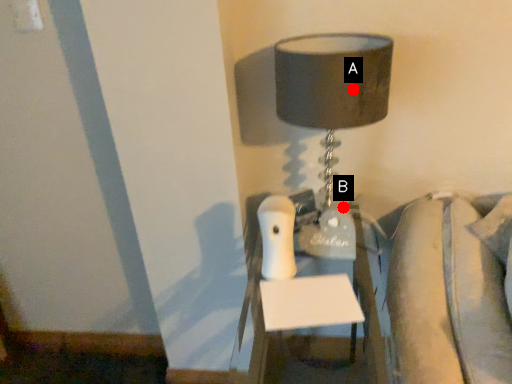
Question: Two points are circled on the image, labeled by A and B beside each circle. Among these points, which one is farthest from the camera?

Choices:
 (A) A is further
 (B) B is further

Answer: (B)